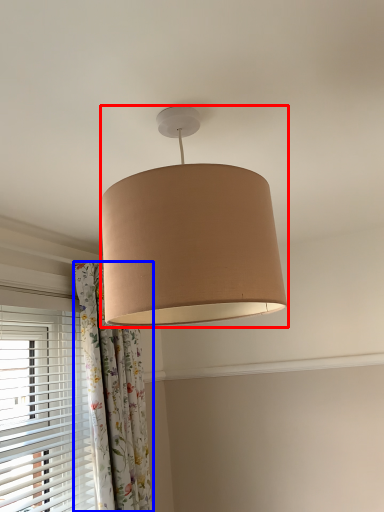
Question: Which object is closer to the camera taking this photo, lamp (highlighted by a red box) or curtain (highlighted by a blue box)?

Choices:
 (A) lamp
 (B) curtain

Answer: (A)